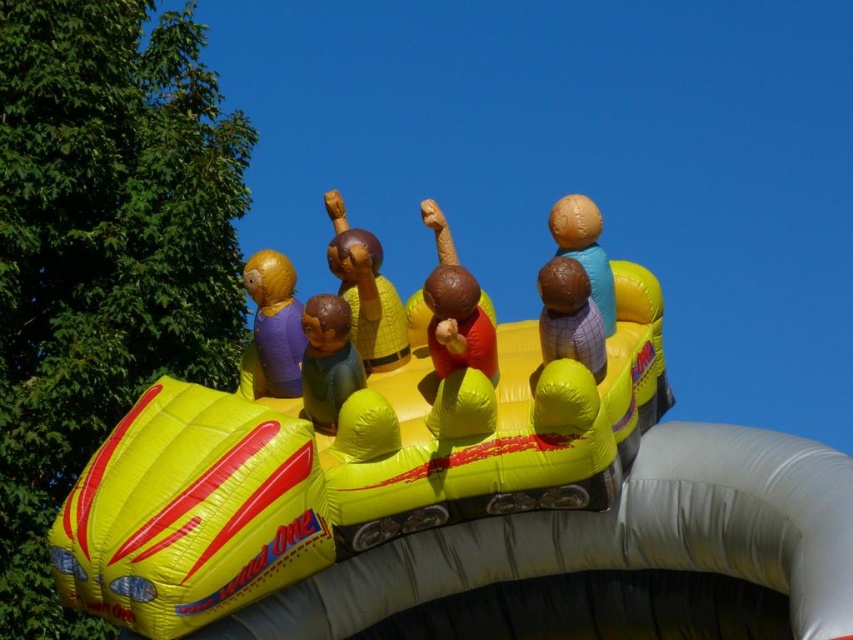
Question: In this image, where is matte yellow figure at center located relative to matte brown figure at center?

Choices:
 (A) above
 (B) below

Answer: (A)

Question: Can you confirm if matte yellow figure at center is positioned to the right of matte brown figure at center?

Choices:
 (A) no
 (B) yes

Answer: (A)

Question: Is yellow matte figure at center below matte brown figure at center?

Choices:
 (A) yes
 (B) no

Answer: (B)

Question: Among these objects, which one is nearest to the camera?

Choices:
 (A) matte yellow figure at center
 (B) yellow matte figure at center
 (C) matte brown ball at center

Answer: (B)

Question: Which point appears farthest from the camera in this image?

Choices:
 (A) (614, 292)
 (B) (281, 365)
 (C) (351, 241)
 (D) (326, 397)

Answer: (A)

Question: Among these objects, which one is farthest from the camera?

Choices:
 (A) yellow matte figure at center
 (B) matte brown ball at center
 (C) matte brown figure at center

Answer: (B)